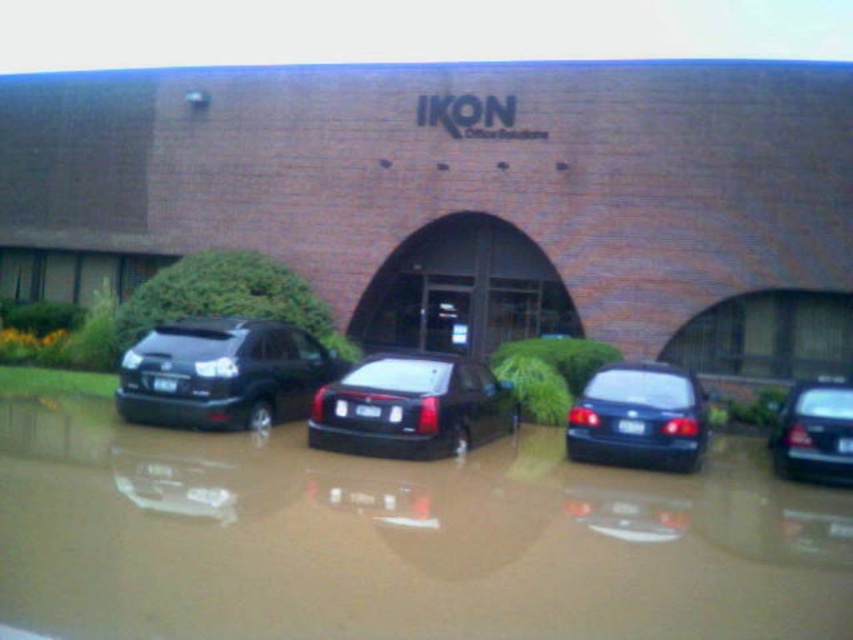
Is point (320, 547) in front of point (625, 388)?

Yes, it is.

Describe the element at coordinates (399, 540) in the screenshot. I see `brown muddy water at lower center` at that location.

I want to click on brown muddy water at lower center, so click(x=399, y=540).

Which is behind, point (155, 355) or point (677, 426)?

The point (155, 355) is behind.

Is point (195, 412) behind point (662, 390)?

Yes.

Which is behind, point (138, 381) or point (670, 372)?

Point (138, 381)

Find the location of `matte black suv at left`. matte black suv at left is located at coordinates (222, 372).

Is matte black suv at left wider than glossy black sedan at center?

No.

Can you confirm if matte black suv at left is bigger than glossy black sedan at center?

Incorrect, matte black suv at left is not larger than glossy black sedan at center.

I want to click on matte black suv at left, so click(x=222, y=372).

In order to click on matte black suv at left in this screenshot , I will do `click(222, 372)`.